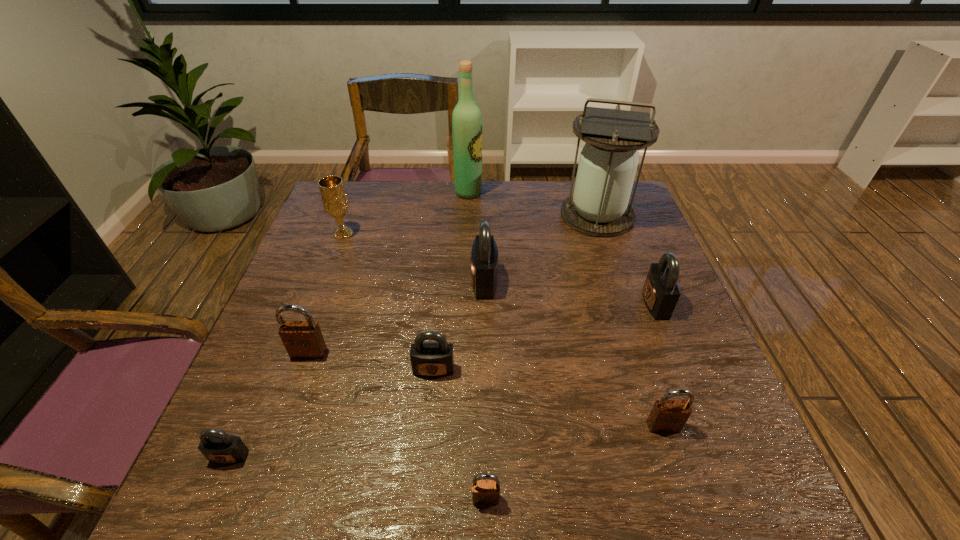
Identify the location of object that stands as the fourth closest to the leftmost padlock. (484, 256).

This screenshot has width=960, height=540. I want to click on the second closest object to the tallest padlock, so click(x=599, y=206).

This screenshot has height=540, width=960. In order to click on padlock that is the third closest to the nearest object in this screenshot , I will do [217, 446].

Choose which padlock is the sixth nearest neighbor to the second smallest brown padlock. Please provide its 2D coordinates. Your answer should be formatted as a tuple, i.e. [(x, y)], where the tuple contains the x and y coordinates of a point satisfying the conditions above.

[(217, 446)]

Identify which gray padlock is the closest to the farthest brown padlock. Please provide its 2D coordinates. Your answer should be formatted as a tuple, i.e. [(x, y)], where the tuple contains the x and y coordinates of a point satisfying the conditions above.

[(428, 359)]

Point out which gray padlock is positioned as the nearest to the third farthest gray padlock. Please provide its 2D coordinates. Your answer should be formatted as a tuple, i.e. [(x, y)], where the tuple contains the x and y coordinates of a point satisfying the conditions above.

[(484, 256)]

Identify the location of brown padlock object that ranks as the closest to the biggest gray padlock. (302, 339).

Point out which brown padlock is positioned as the second nearest to the second brown padlock from right to left. Please provide its 2D coordinates. Your answer should be formatted as a tuple, i.e. [(x, y)], where the tuple contains the x and y coordinates of a point satisfying the conditions above.

[(302, 339)]

Find the location of `vacant area in the image that satisfies the following two spatial constraints: 1. on the front-facing side of the wine bottle; 2. on the front-facing side of the third farthest padlock`. vacant area in the image that satisfies the following two spatial constraints: 1. on the front-facing side of the wine bottle; 2. on the front-facing side of the third farthest padlock is located at coordinates (463, 353).

Find the location of a particular element. This screenshot has height=540, width=960. vacant space that satisfies the following two spatial constraints: 1. on the front-facing side of the white wine bottle; 2. on the front-facing side of the fifth nearest padlock is located at coordinates (463, 353).